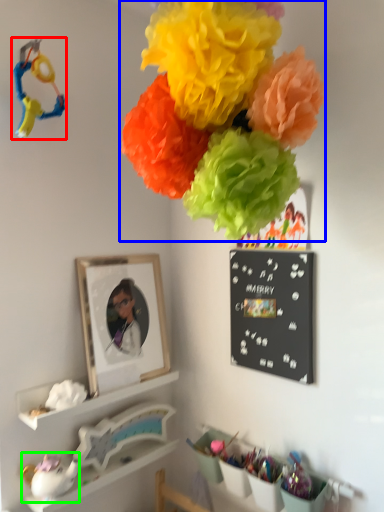
Question: Based on their relative distances, which object is nearer to toy (highlighted by a red box)? Choose from flower (highlighted by a blue box) and toy (highlighted by a green box).

Choices:
 (A) flower
 (B) toy

Answer: (A)